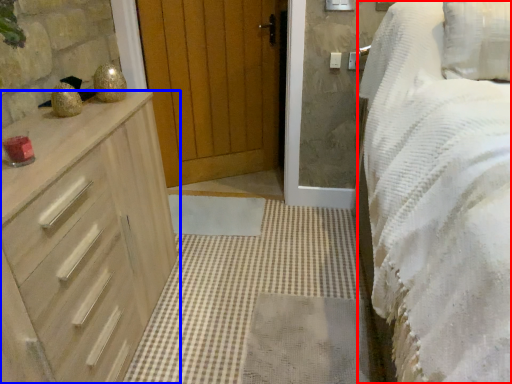
Question: Which object is further to the camera taking this photo, bed (highlighted by a red box) or chest of drawers (highlighted by a blue box)?

Choices:
 (A) bed
 (B) chest of drawers

Answer: (B)